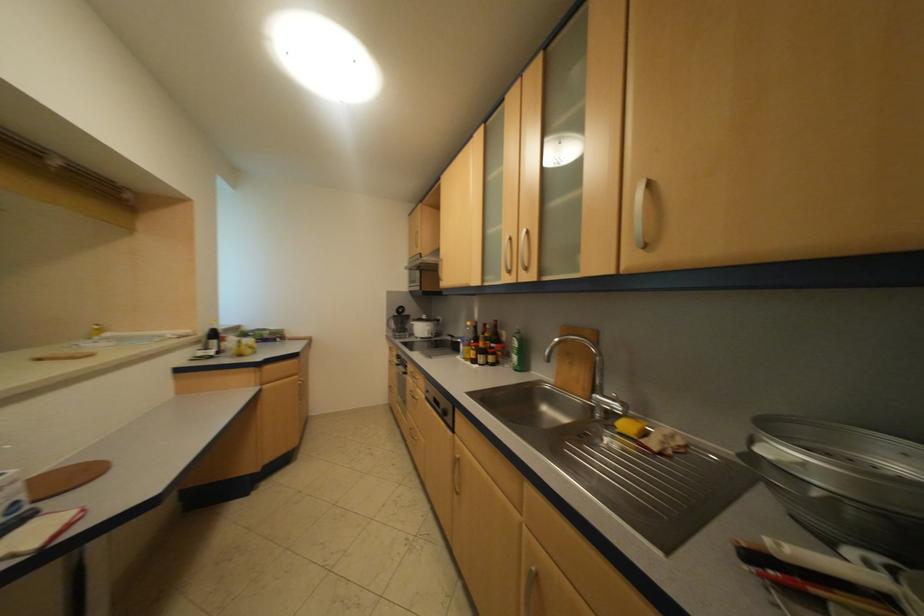
Locate an element on the screen. faucet handle is located at coordinates (614, 403).